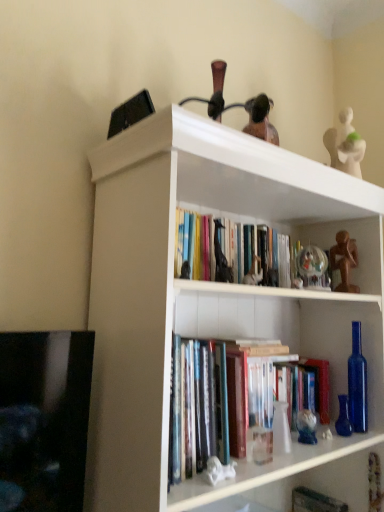
Identify the location of transparent glass globe at upper center, acting as the second toy starting from the back. Image resolution: width=384 pixels, height=512 pixels. (313, 267).

In order to click on matte black giraffe at center, which appears as the 2th toy when viewed from the front in this screenshot , I will do `click(221, 258)`.

Where is `white glossy statue at lower center, acting as the 5th toy starting from the back`? The height and width of the screenshot is (512, 384). white glossy statue at lower center, acting as the 5th toy starting from the back is located at coordinates click(x=219, y=470).

Measure the distance between hardcover books at center and camera.

A distance of 91.90 centimeters exists between hardcover books at center and camera.

In order to face hardcover book at center, should I rotate leftwards or rightwards?

Rotate right and turn 17.185 degrees.

At what (x,y) coordinates should I click in order to perform the action: click on translucent glass figurine at center, the first toy from the bottom. Please return your answer as a coordinate pair (x, y). Looking at the image, I should click on (307, 426).

This screenshot has height=512, width=384. What are the coordinates of `wooden statue at upper right, which appears as the 1th toy when viewed from the back` in the screenshot? It's located at pos(344,261).

How much distance is there between translucent glass figurine at center, the 5th toy positioned from the top, and hardcover books at center?

23.30 inches.

Is the position of translucent glass figurine at center, which is the third toy from front to back, less distant than that of hardcover books at center?

No, the depth of translucent glass figurine at center, which is the third toy from front to back, is greater than that of hardcover books at center.

From the image's perspective, which one is positioned higher, translucent glass figurine at center, which is the 3th toy in right-to-left order, or hardcover books at center?

hardcover books at center, from the image's perspective.

From a real-world perspective, who is located lower, translucent glass figurine at center, the 3th toy from the left, or hardcover books at center?

translucent glass figurine at center, the 3th toy from the left, from a real-world perspective.

Would you say hardcover books at center contains wooden statue at upper right, which is the 5th toy in front-to-back order?

No, wooden statue at upper right, which is the 5th toy in front-to-back order, is not a part of hardcover books at center.

Is hardcover books at center wider or thinner than wooden statue at upper right, which is the 5th toy in front-to-back order?

In the image, hardcover books at center appears to be wider than wooden statue at upper right, which is the 5th toy in front-to-back order.

Based on the photo, from the image's perspective, is hardcover books at center located above wooden statue at upper right, the fourth toy ordered from the bottom?

Indeed, from the image's perspective, hardcover books at center is shown above wooden statue at upper right, the fourth toy ordered from the bottom.

Is point (342, 504) less distant than point (343, 237)?

No, it is behind (343, 237).

Is hardcover book at center turned away from wooden statue at upper right, the fourth toy ordered from the bottom?

No, hardcover book at center is not facing the opposite direction of wooden statue at upper right, the fourth toy ordered from the bottom.

Which is in front, hardcover book at center or wooden statue at upper right, which is the 5th toy from left to right?

hardcover book at center.

Considering the sizes of hardcover book at center and wooden statue at upper right, the fourth toy ordered from the bottom, in the image, is hardcover book at center wider or thinner than wooden statue at upper right, the fourth toy ordered from the bottom,?

In the image, hardcover book at center appears to be wider than wooden statue at upper right, the fourth toy ordered from the bottom.

Is the position of white glossy statue at lower center, arranged as the 5th toy when viewed from the right, more distant than that of transparent glass globe at upper center, marked as the third toy in a top-to-bottom arrangement?

No, white glossy statue at lower center, arranged as the 5th toy when viewed from the right, is closer to the viewer.

From a real-world perspective, who is located lower, white glossy statue at lower center, arranged as the 5th toy when viewed from the right, or transparent glass globe at upper center, acting as the second toy starting from the back?

white glossy statue at lower center, arranged as the 5th toy when viewed from the right.

How far apart are white glossy statue at lower center, placed as the first toy when sorted from front to back, and transparent glass globe at upper center, which is the 3th toy from bottom to top?

white glossy statue at lower center, placed as the first toy when sorted from front to back, is 60.31 centimeters from transparent glass globe at upper center, which is the 3th toy from bottom to top.

From the image's perspective, is white glossy statue at lower center, the second toy in the bottom-to-top sequence, above transparent glass globe at upper center, which is the 3th toy from bottom to top?

Actually, white glossy statue at lower center, the second toy in the bottom-to-top sequence, appears below transparent glass globe at upper center, which is the 3th toy from bottom to top, in the image.

From the image's perspective, is hardcover books at center located beneath translucent glass figurine at center, the 3th toy from the left?

No, from the image's perspective, hardcover books at center is not below translucent glass figurine at center, the 3th toy from the left.

Is hardcover books at center aimed at translucent glass figurine at center, the 5th toy positioned from the top?

No.

Based on the photo, is hardcover books at center wider or thinner than translucent glass figurine at center, which is the third toy from front to back?

In the image, hardcover books at center appears to be wider than translucent glass figurine at center, which is the third toy from front to back.

Would you say hardcover books at center is outside translucent glass figurine at center, the third toy viewed from the back?

That's correct, hardcover books at center is outside of translucent glass figurine at center, the third toy viewed from the back.

Is matte black giraffe at center, which is counted as the 4th toy, starting from the back, shorter than hardcover book at center?

Yes.

In the scene shown: Could you tell me if matte black giraffe at center, the 5th toy when ordered from bottom to top, is turned towards hardcover book at center?

No, matte black giraffe at center, the 5th toy when ordered from bottom to top, is not facing towards hardcover book at center.

Considering the positions of objects matte black giraffe at center, the 2th toy positioned from the left, and hardcover book at center in the image provided, who is more to the right, matte black giraffe at center, the 2th toy positioned from the left, or hardcover book at center?

hardcover book at center.

Considering their positions, is matte black giraffe at center, which appears as the 2th toy when viewed from the front, located in front of or behind hardcover book at center?

In the image, matte black giraffe at center, which appears as the 2th toy when viewed from the front, appears in front of hardcover book at center.

Which of these two, translucent glass figurine at center, which is the third toy from front to back, or hardcover book at center, is wider?

Wider between the two is hardcover book at center.

From a real-world perspective, which object stands above the other?

translucent glass figurine at center, which is the third toy from front to back.

Where is `the 2nd toy to the left of the hardcover book at center, starting your count from the anchor`? This screenshot has height=512, width=384. the 2nd toy to the left of the hardcover book at center, starting your count from the anchor is located at coordinates (307, 426).

Is translucent glass figurine at center, the 5th toy positioned from the top, bigger or smaller than hardcover book at center?

In the image, translucent glass figurine at center, the 5th toy positioned from the top, appears to be smaller than hardcover book at center.

From the image's perspective, starting from the hardcover books at center, which toy is the 4th one below? Please provide its 2D coordinates.

[(307, 426)]

Locate an element on the screen. This screenshot has height=512, width=384. book above the wooden statue at upper right, the fourth toy ordered from the bottom (from a real-world perspective) is located at coordinates (230, 251).

Considering their positions, is white glossy bookshelf at upper center positioned further to white glossy statue at lower center, acting as the 4th toy starting from the top, than matte black giraffe at center, which appears as the 2th toy when viewed from the front?

Based on the image, white glossy bookshelf at upper center appears to be further to white glossy statue at lower center, acting as the 4th toy starting from the top.

From the image, which object appears to be farther from transparent glass globe at upper center, marked as the third toy in a top-to-bottom arrangement, hardcover book at center or white glossy statue at lower center, placed as the first toy when sorted from front to back?

hardcover book at center is further to transparent glass globe at upper center, marked as the third toy in a top-to-bottom arrangement.

Estimate the real-world distances between objects in this image. Which object is closer to white glossy bookshelf at upper center, wooden statue at upper right, which is the 5th toy from left to right, or hardcover book at center?

wooden statue at upper right, which is the 5th toy from left to right, lies closer to white glossy bookshelf at upper center than the other object.

Considering their positions, is matte black giraffe at center, the 5th toy when ordered from bottom to top, positioned further to hardcover book at center than white glossy statue at lower center, arranged as the 5th toy when viewed from the right?

matte black giraffe at center, the 5th toy when ordered from bottom to top.

In the scene shown: Estimate the real-world distances between objects in this image. Which object is closer to white glossy statue at lower center, acting as the 4th toy starting from the top, hardcover book at center or white glossy bookshelf at upper center?

The object closer to white glossy statue at lower center, acting as the 4th toy starting from the top, is white glossy bookshelf at upper center.

Considering their positions, is transparent glass globe at upper center, which appears as the fourth toy when viewed from the left, positioned closer to translucent glass figurine at center, which is the 3th toy in right-to-left order, than hardcover books at center?

Among the two, transparent glass globe at upper center, which appears as the fourth toy when viewed from the left, is located nearer to translucent glass figurine at center, which is the 3th toy in right-to-left order.

Based on their spatial positions, is hardcover books at center or hardcover book at center further from matte black giraffe at center, which appears as the 2th toy when viewed from the front?

hardcover book at center.

Looking at the image, which one is located closer to hardcover books at center, transparent glass globe at upper center, acting as the second toy starting from the back, or wooden statue at upper right, which is the 5th toy from left to right?

Based on the image, transparent glass globe at upper center, acting as the second toy starting from the back, appears to be nearer to hardcover books at center.

Image resolution: width=384 pixels, height=512 pixels. Identify the location of book between white glossy bookshelf at upper center and matte black giraffe at center, which appears as the 2th toy when viewed from the front, in the front-back direction. (230, 251).

Identify the location of book between white glossy bookshelf at upper center and translucent glass figurine at center, the 3th toy from the left, along the z-axis. (230, 251).

Image resolution: width=384 pixels, height=512 pixels. In order to click on book situated between matte black giraffe at center, which is the first toy in top-to-bottom order, and wooden statue at upper right, which ranks as the second toy in top-to-bottom order, from left to right in this screenshot , I will do `click(230, 251)`.

What are the coordinates of `book between matte black giraffe at center, which is the first toy in top-to-bottom order, and transparent glass globe at upper center, placed as the second toy when sorted from right to left` in the screenshot? It's located at (230, 251).